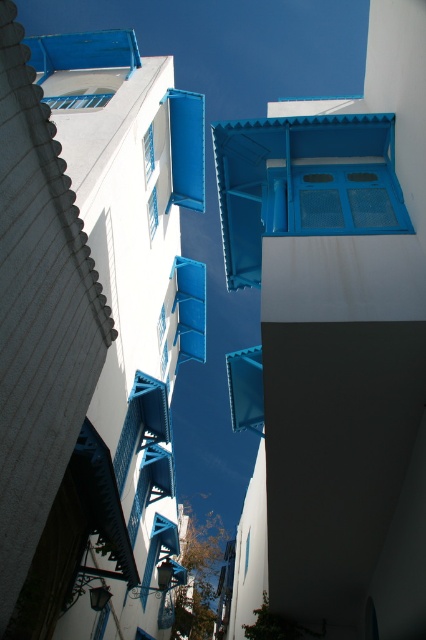
Question: Which object is the farthest from the blue matte window at center?

Choices:
 (A) blue matte window at upper left
 (B) blue matte window at upper center
 (C) matte blue window at center

Answer: (A)

Question: Which point is farther to the camera?

Choices:
 (A) (146, 173)
 (B) (147, 211)
 (C) (397, 202)

Answer: (B)

Question: Considering the relative positions of blue matte window at upper center and matte blue window at center in the image provided, where is blue matte window at upper center located with respect to matte blue window at center?

Choices:
 (A) right
 (B) left

Answer: (A)

Question: Can you confirm if blue matte window at center is positioned to the left of blue matte window at upper center?

Choices:
 (A) no
 (B) yes

Answer: (A)

Question: Can you confirm if blue matte window at upper left is smaller than blue matte window at upper center?

Choices:
 (A) no
 (B) yes

Answer: (A)

Question: Which object is closer to the camera taking this photo?

Choices:
 (A) blue matte window at center
 (B) blue matte window at upper left

Answer: (A)